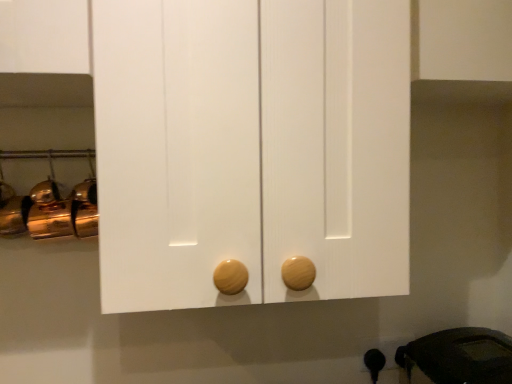
Question: Should I look upward or downward to see black rubber kettle at lower right?

Choices:
 (A) down
 (B) up

Answer: (A)

Question: Is black rubber kettle at lower right looking in the opposite direction of wooden at bottom?

Choices:
 (A) yes
 (B) no

Answer: (B)

Question: From a real-world perspective, is black rubber kettle at lower right positioned under wooden at bottom based on gravity?

Choices:
 (A) no
 (B) yes

Answer: (A)

Question: Is black rubber kettle at lower right wider than wooden at bottom?

Choices:
 (A) no
 (B) yes

Answer: (B)

Question: Are black rubber kettle at lower right and wooden at bottom beside each other?

Choices:
 (A) no
 (B) yes

Answer: (A)

Question: Considering the relative sizes of black rubber kettle at lower right and wooden at bottom in the image provided, is black rubber kettle at lower right thinner than wooden at bottom?

Choices:
 (A) no
 (B) yes

Answer: (A)

Question: From the image's perspective, is black rubber kettle at lower right on wooden at bottom?

Choices:
 (A) no
 (B) yes

Answer: (B)

Question: Does wooden at bottom come in front of black rubber kettle at lower right?

Choices:
 (A) no
 (B) yes

Answer: (A)

Question: Would you consider wooden at bottom to be distant from black rubber kettle at lower right?

Choices:
 (A) no
 (B) yes

Answer: (A)

Question: Is black rubber kettle at lower right completely or partially inside wooden at bottom?

Choices:
 (A) no
 (B) yes

Answer: (A)

Question: Can you confirm if wooden at bottom is positioned to the right of black rubber kettle at lower right?

Choices:
 (A) no
 (B) yes

Answer: (A)

Question: Considering the relative sizes of wooden at bottom and black rubber kettle at lower right in the image provided, is wooden at bottom shorter than black rubber kettle at lower right?

Choices:
 (A) no
 (B) yes

Answer: (B)

Question: From a real-world perspective, is wooden at bottom positioned over black rubber kettle at lower right based on gravity?

Choices:
 (A) no
 (B) yes

Answer: (A)

Question: Is black rubber kettle at lower right spatially inside wooden at bottom, or outside of it?

Choices:
 (A) outside
 (B) inside

Answer: (A)